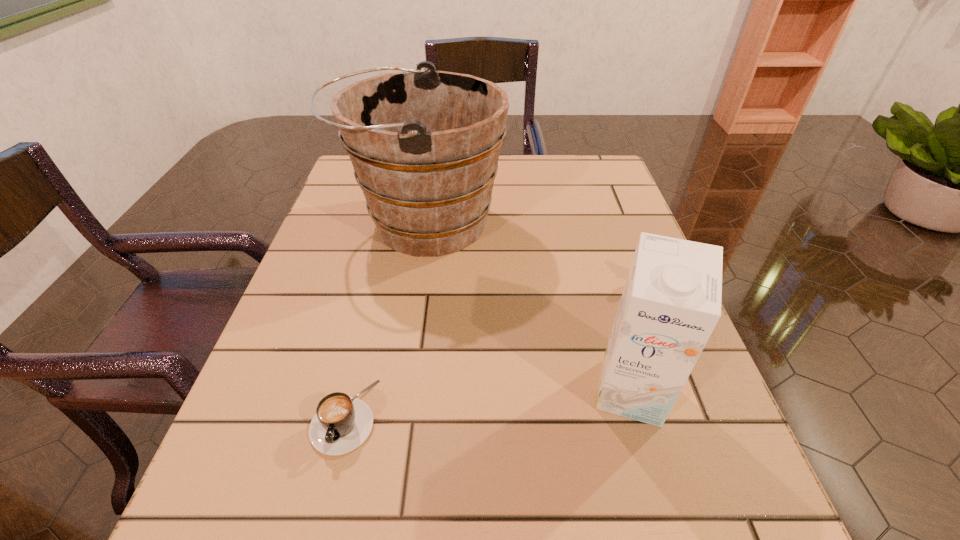
The image size is (960, 540). What are the coordinates of `the farthest object` in the screenshot? It's located at (424, 144).

Locate an element on the screen. the rightmost object is located at coordinates (671, 303).

At what (x,y) coordinates should I click in order to perform the action: click on cappuccino. Please return your answer as a coordinate pair (x, y). This screenshot has height=540, width=960. Looking at the image, I should click on (341, 424).

Identify the location of free space located 0.130m on the back of the carton. The image size is (960, 540). (606, 305).

You are a GUI agent. You are given a task and a screenshot of the screen. Output one action in this format:
    pyautogui.click(x=<x>, y=<y>)
    Task: Click on the object that is at the far edge
    The height and width of the screenshot is (540, 960).
    Given the screenshot: What is the action you would take?
    pyautogui.click(x=424, y=144)

You are a GUI agent. You are given a task and a screenshot of the screen. Output one action in this format:
    pyautogui.click(x=<x>, y=<y>)
    Task: Click on the bucket positioned at the left edge
    
    Given the screenshot: What is the action you would take?
    pyautogui.click(x=424, y=144)

At what (x,y) coordinates should I click in order to perform the action: click on cappuccino that is at the left edge. Please return your answer as a coordinate pair (x, y). Looking at the image, I should click on (341, 424).

Image resolution: width=960 pixels, height=540 pixels. Find the location of `object at the right edge`. object at the right edge is located at coordinates (671, 303).

Locate an element on the screen. This screenshot has width=960, height=540. object present at the far left corner is located at coordinates (424, 144).

This screenshot has height=540, width=960. In the image, there is a desktop. What are the coordinates of `vacant space at the far edge` in the screenshot? It's located at (501, 158).